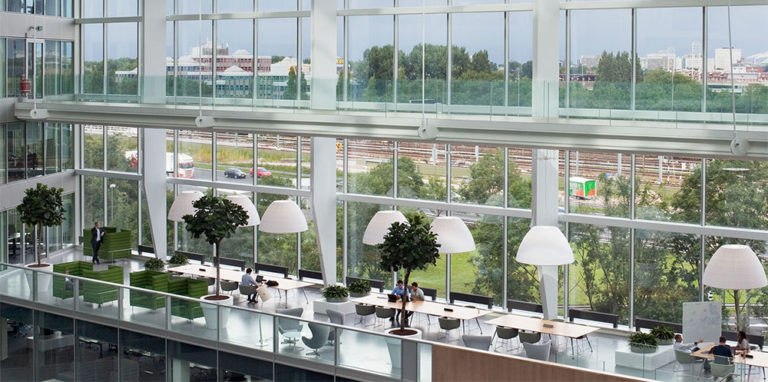
Locate an element on the screen. The height and width of the screenshot is (382, 768). table top is located at coordinates (752, 359), (574, 333), (462, 314), (194, 268).